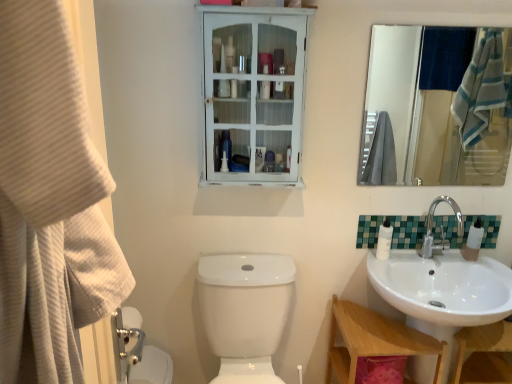
What is the approximate height of chrome metallic faucet at right?

It is 8.77 inches.

Where is `green mosaic tile at right`? The width and height of the screenshot is (512, 384). green mosaic tile at right is located at coordinates (467, 229).

Describe the element at coordinates (467, 229) in the screenshot. I see `green mosaic tile at right` at that location.

Describe the element at coordinates (245, 312) in the screenshot. I see `white glossy toilet bowl at lower center, acting as the second toilet bowl starting from the left` at that location.

Consider the image. What is the approximate width of beige textured towel at left?

beige textured towel at left is 6.70 inches in width.

What do you see at coordinates (384, 240) in the screenshot? I see `white glossy lotion at right` at bounding box center [384, 240].

The image size is (512, 384). I want to click on translucent plastic soap dispenser at sink right, so click(473, 241).

Looking at the image, does white glossy toilet bowl at lower center, acting as the second toilet bowl starting from the left, seem bigger or smaller compared to green mosaic tile at right?

Clearly, white glossy toilet bowl at lower center, acting as the second toilet bowl starting from the left, is larger in size than green mosaic tile at right.

Where is `the 1st toilet bowl located beneath the green mosaic tile at right (from a real-world perspective)`? the 1st toilet bowl located beneath the green mosaic tile at right (from a real-world perspective) is located at coordinates (245, 312).

Is white glossy toilet bowl at lower center, marked as the 1th toilet bowl in a right-to-left arrangement, not inside green mosaic tile at right?

Yes, white glossy toilet bowl at lower center, marked as the 1th toilet bowl in a right-to-left arrangement, is outside of green mosaic tile at right.

Is white glossy toilet bowl at lower center, marked as the 1th toilet bowl in a right-to-left arrangement, wider or thinner than green mosaic tile at right?

Considering their sizes, white glossy toilet bowl at lower center, marked as the 1th toilet bowl in a right-to-left arrangement, looks broader than green mosaic tile at right.

How much distance is there between white distressed wood medicine cabinet at upper center and white glossy toilet bowl at lower center, acting as the second toilet bowl starting from the left?

They are 22.91 inches apart.

Is white distressed wood medicine cabinet at upper center far away from white glossy toilet bowl at lower center, acting as the second toilet bowl starting from the left?

No, white distressed wood medicine cabinet at upper center is not far away from white glossy toilet bowl at lower center, acting as the second toilet bowl starting from the left.

Looking at this image, is the depth of white distressed wood medicine cabinet at upper center less than that of white glossy toilet bowl at lower center, acting as the second toilet bowl starting from the left?

No, the depth of white distressed wood medicine cabinet at upper center is greater than that of white glossy toilet bowl at lower center, acting as the second toilet bowl starting from the left.

In the scene shown: Considering the sizes of white distressed wood medicine cabinet at upper center and white glossy toilet bowl at lower center, marked as the 1th toilet bowl in a right-to-left arrangement, in the image, is white distressed wood medicine cabinet at upper center taller or shorter than white glossy toilet bowl at lower center, marked as the 1th toilet bowl in a right-to-left arrangement,?

In the image, white distressed wood medicine cabinet at upper center appears to be shorter than white glossy toilet bowl at lower center, marked as the 1th toilet bowl in a right-to-left arrangement.

Which is further, (56,138) or (376,235)?

The point (376,235) is farther.

Is beige textured towel at left bigger than green mosaic tile at right?

Correct, beige textured towel at left is larger in size than green mosaic tile at right.

Would you say green mosaic tile at right is part of beige textured towel at left's contents?

No, green mosaic tile at right is located outside of beige textured towel at left.

Is beige textured towel at left directly adjacent to green mosaic tile at right?

No, beige textured towel at left is not making contact with green mosaic tile at right.

Does white glossy toilet bowl at lower left, acting as the second toilet bowl starting from the right, have a lesser width compared to wooden at lower right?

Correct, the width of white glossy toilet bowl at lower left, acting as the second toilet bowl starting from the right, is less than that of wooden at lower right.

From a real-world perspective, does white glossy toilet bowl at lower left, acting as the second toilet bowl starting from the right, sit lower than wooden at lower right?

Yes.

In the scene shown: Which is more to the left, white glossy toilet bowl at lower left, the first toilet bowl when ordered from left to right, or wooden at lower right?

Positioned to the left is white glossy toilet bowl at lower left, the first toilet bowl when ordered from left to right.

Which is closer, (143, 347) or (365, 312)?

The point (143, 347) is closer to the camera.

Which of these two, white glossy toilet bowl at lower left, acting as the second toilet bowl starting from the right, or translucent plastic soap dispenser at sink right, stands shorter?

translucent plastic soap dispenser at sink right is shorter.

Is there a large distance between white glossy toilet bowl at lower left, the first toilet bowl when ordered from left to right, and translucent plastic soap dispenser at sink right?

white glossy toilet bowl at lower left, the first toilet bowl when ordered from left to right, is positioned a significant distance from translucent plastic soap dispenser at sink right.

From the image's perspective, is white glossy toilet bowl at lower left, the first toilet bowl when ordered from left to right, above or below translucent plastic soap dispenser at sink right?

white glossy toilet bowl at lower left, the first toilet bowl when ordered from left to right, is below translucent plastic soap dispenser at sink right.

Which point is more distant from viewer, (x=148, y=373) or (x=467, y=260)?

The point (x=467, y=260) is behind.

From a real-world perspective, which is physically below, white glossy toilet bowl at lower center, marked as the 1th toilet bowl in a right-to-left arrangement, or white distressed wood medicine cabinet at upper center?

white glossy toilet bowl at lower center, marked as the 1th toilet bowl in a right-to-left arrangement, is physically lower.

Which is farther from the camera, [290,277] or [256,11]?

The point [290,277] is behind.

Is white glossy toilet bowl at lower center, marked as the 1th toilet bowl in a right-to-left arrangement, shorter than white distressed wood medicine cabinet at upper center?

In fact, white glossy toilet bowl at lower center, marked as the 1th toilet bowl in a right-to-left arrangement, may be taller than white distressed wood medicine cabinet at upper center.

From the image's perspective, is white glossy toilet bowl at lower center, acting as the second toilet bowl starting from the left, positioned above or below white distressed wood medicine cabinet at upper center?

white glossy toilet bowl at lower center, acting as the second toilet bowl starting from the left, is situated lower than white distressed wood medicine cabinet at upper center in the image.

Which object is wider, white glossy toilet bowl at lower center, marked as the 1th toilet bowl in a right-to-left arrangement, or white glossy toilet bowl at lower left, acting as the second toilet bowl starting from the right?

Wider between the two is white glossy toilet bowl at lower center, marked as the 1th toilet bowl in a right-to-left arrangement.

Considering the points (249, 314) and (151, 366), which point is behind, point (249, 314) or point (151, 366)?

The point (151, 366) is behind.

From the image's perspective, does white glossy toilet bowl at lower center, acting as the second toilet bowl starting from the left, appear lower than white glossy toilet bowl at lower left, the first toilet bowl when ordered from left to right?

No.

Is white glossy toilet bowl at lower center, marked as the 1th toilet bowl in a right-to-left arrangement, oriented away from white glossy toilet bowl at lower left, acting as the second toilet bowl starting from the right?

No, white glossy toilet bowl at lower center, marked as the 1th toilet bowl in a right-to-left arrangement, is not facing away from white glossy toilet bowl at lower left, acting as the second toilet bowl starting from the right.

Which toilet bowl is the 1st one when counting from the left side of the green mosaic tile at right? Please provide its 2D coordinates.

[(245, 312)]

The image size is (512, 384). Find the location of `toilet bowl in front of the white distressed wood medicine cabinet at upper center`. toilet bowl in front of the white distressed wood medicine cabinet at upper center is located at coordinates (245, 312).

Estimate the real-world distances between objects in this image. Which object is closer to white glossy lotion at right, white distressed wood medicine cabinet at upper center or translucent plastic soap dispenser at sink right?

translucent plastic soap dispenser at sink right is positioned closer to the anchor white glossy lotion at right.

Looking at the image, which one is located closer to beige textured towel at left, green mosaic tile at right or chrome metallic faucet at right?

green mosaic tile at right is positioned closer to the anchor beige textured towel at left.

Based on their spatial positions, is green mosaic tile at right or translucent plastic soap dispenser at sink right further from white distressed wood medicine cabinet at upper center?

translucent plastic soap dispenser at sink right is further to white distressed wood medicine cabinet at upper center.

Consider the image. Looking at the image, which one is located closer to white glossy lotion at right, wooden at lower right or white glossy toilet bowl at lower center, marked as the 1th toilet bowl in a right-to-left arrangement?

Among the two, wooden at lower right is located nearer to white glossy lotion at right.

Which object lies nearer to the anchor point white glossy lotion at right, white glossy toilet bowl at lower center, marked as the 1th toilet bowl in a right-to-left arrangement, or beige textured towel at left?

white glossy toilet bowl at lower center, marked as the 1th toilet bowl in a right-to-left arrangement, lies closer to white glossy lotion at right than the other object.

When comparing their distances from green mosaic tile at right, does translucent plastic soap dispenser at sink right or white glossy toilet bowl at lower center, acting as the second toilet bowl starting from the left, seem further?

Among the two, white glossy toilet bowl at lower center, acting as the second toilet bowl starting from the left, is located further to green mosaic tile at right.

Based on their spatial positions, is wooden at lower right or translucent plastic soap dispenser at sink right further from white distressed wood medicine cabinet at upper center?

translucent plastic soap dispenser at sink right is further to white distressed wood medicine cabinet at upper center.

Based on their spatial positions, is beige textured towel at left or white distressed wood medicine cabinet at upper center closer to chrome metallic faucet at right?

white distressed wood medicine cabinet at upper center lies closer to chrome metallic faucet at right than the other object.

Find the location of a particular element. The width and height of the screenshot is (512, 384). tile between white glossy toilet bowl at lower center, marked as the 1th toilet bowl in a right-to-left arrangement, and chrome metallic faucet at right from left to right is located at coordinates (467, 229).

This screenshot has height=384, width=512. I want to click on soap dispenser that lies between chrome metallic faucet at right and wooden at lower right from top to bottom, so [x=473, y=241].

Where is `toilet bowl located between white glossy toilet bowl at lower left, acting as the second toilet bowl starting from the right, and chrome metallic faucet at right in the left-right direction`? toilet bowl located between white glossy toilet bowl at lower left, acting as the second toilet bowl starting from the right, and chrome metallic faucet at right in the left-right direction is located at coordinates (245, 312).

The width and height of the screenshot is (512, 384). I want to click on toiletry that lies between white distressed wood medicine cabinet at upper center and white glossy toilet bowl at lower left, the first toilet bowl when ordered from left to right, from top to bottom, so click(x=384, y=240).